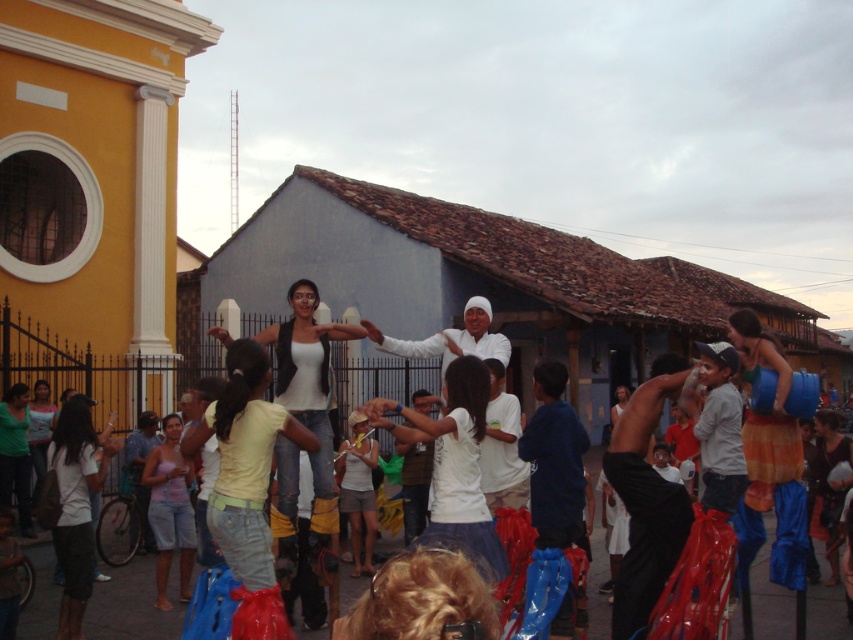
Can you confirm if blue fabric skirt at right is taller than white cotton shirt at lower left?

Incorrect, blue fabric skirt at right's height is not larger of white cotton shirt at lower left's.

Who is more distant from viewer, (x=798, y=528) or (x=54, y=552)?

Positioned behind is point (x=54, y=552).

The width and height of the screenshot is (853, 640). I want to click on blue fabric skirt at right, so click(x=769, y=456).

Between white matte tank top at center and matte green shirt at lower left, which one has more height?

matte green shirt at lower left

Who is more forward, [323,452] or [19,524]?

Positioned in front is point [323,452].

At what (x,y) coordinates should I click in order to perform the action: click on white matte tank top at center. Please return your answer as a coordinate pair (x, y). The height and width of the screenshot is (640, 853). Looking at the image, I should click on (277, 440).

Where is `white matte tank top at center`? The width and height of the screenshot is (853, 640). white matte tank top at center is located at coordinates (277, 440).

Is white cotton shirt at center further to the viewer compared to white cotton shirt at lower left?

That is False.

Is white cotton shirt at center to the right of white cotton shirt at lower left from the viewer's perspective?

Indeed, white cotton shirt at center is positioned on the right side of white cotton shirt at lower left.

Is point (453, 364) positioned in front of point (73, 508)?

That is True.

Identify the location of white cotton shirt at center. (456, 467).